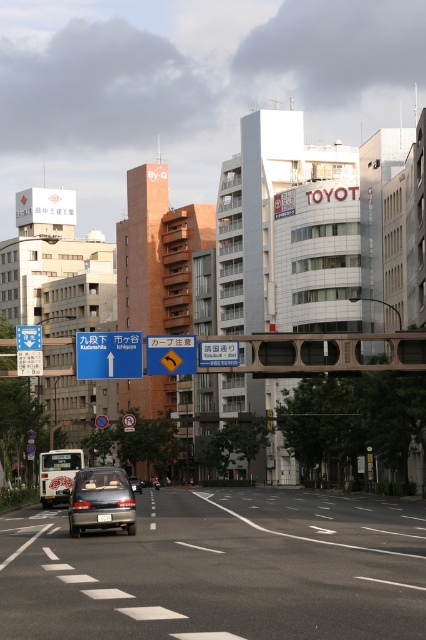
Between point (333, 364) and point (178, 356), which one is positioned in front?

Positioned in front is point (178, 356).

Is metallic gray bridge at center below yellow plastic traffic sign at center?

Actually, metallic gray bridge at center is above yellow plastic traffic sign at center.

Is point (232, 369) positioned in front of point (187, 349)?

No, it is not.

Image resolution: width=426 pixels, height=640 pixels. Find the location of `metallic gray bridge at center`. metallic gray bridge at center is located at coordinates (325, 353).

Which is more to the left, blue plastic sign at upper center or matte silver sedan at center?

matte silver sedan at center is more to the left.

Can you confirm if blue plastic sign at upper center is wider than matte silver sedan at center?

No, blue plastic sign at upper center is not wider than matte silver sedan at center.

Describe the element at coordinates (109, 355) in the screenshot. The height and width of the screenshot is (640, 426). I see `blue plastic sign at upper center` at that location.

The height and width of the screenshot is (640, 426). What are the coordinates of `blue plastic sign at upper center` in the screenshot? It's located at (109, 355).

This screenshot has width=426, height=640. Identify the location of matte gray car at center. (100, 500).